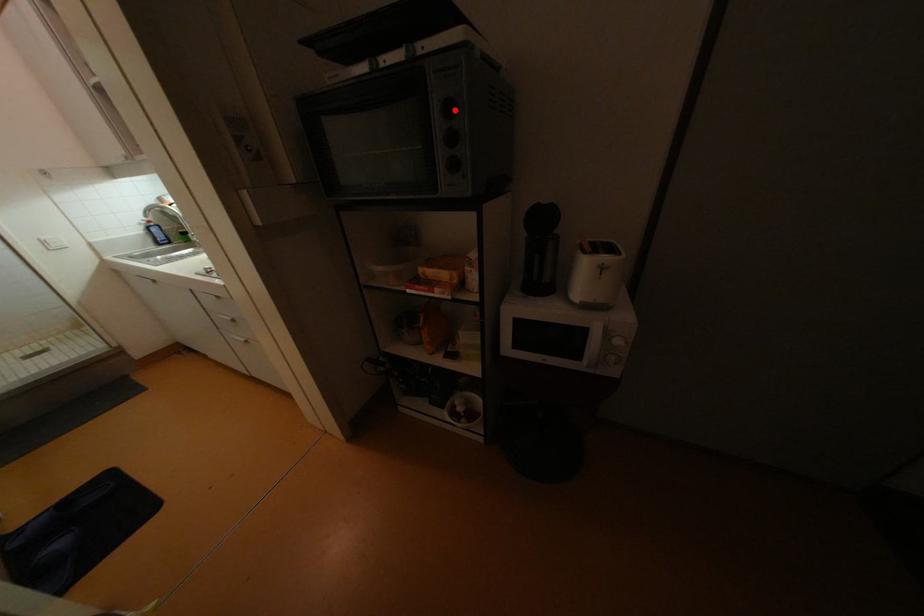
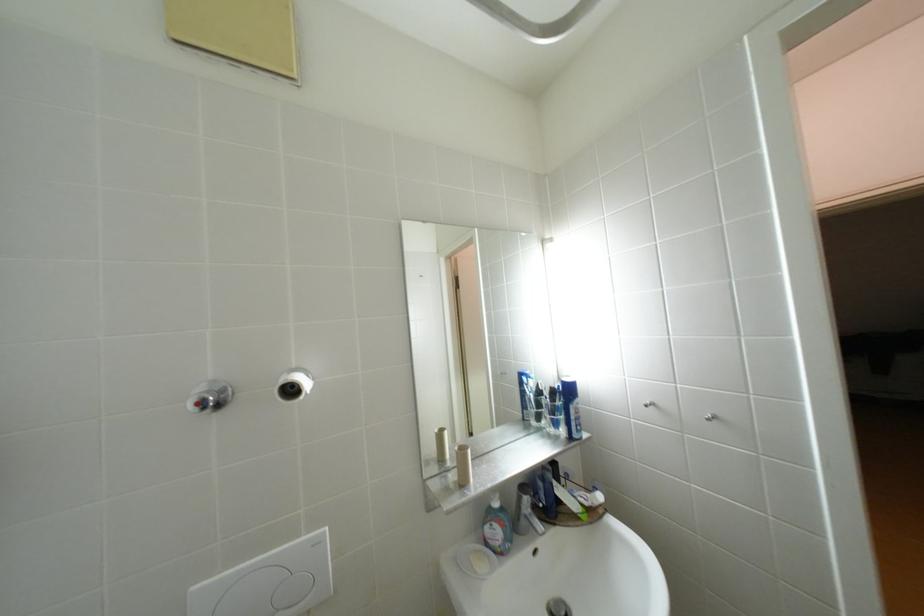
Question: I am providing you with two images of the same scene from different viewpoints. A red point is marked on the first image. Can you still see the location of the red point in image 2?

Choices:
 (A) Yes
 (B) No

Answer: (B)